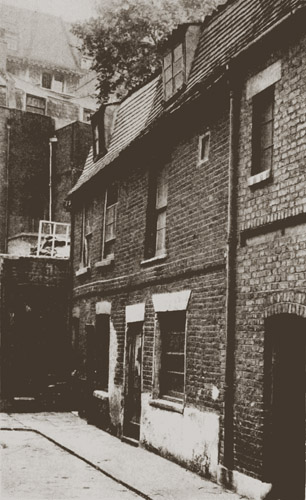
I want to click on door, so click(133, 387).